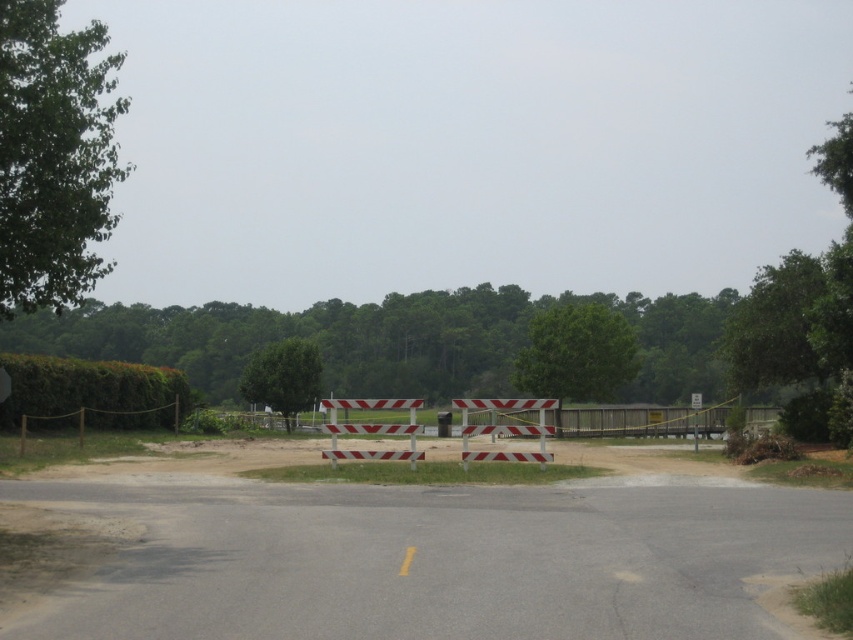
Question: Which object is the farthest from the reflective plastic barricade at center?

Choices:
 (A) white striped plastic barricade at center
 (B) white plastic sign at center

Answer: (B)

Question: Does white striped plastic barricade at center appear over reflective plastic barricade at center?

Choices:
 (A) yes
 (B) no

Answer: (B)

Question: Can you confirm if white striped plastic barricade at center is bigger than reflective plastic barricade at center?

Choices:
 (A) yes
 (B) no

Answer: (B)

Question: Does reflective plastic barricade at center have a lesser width compared to white plastic sign at center?

Choices:
 (A) yes
 (B) no

Answer: (A)

Question: Which is farther from the reflective plastic barricade at center?

Choices:
 (A) white plastic sign at center
 (B) white striped plastic barricade at center

Answer: (A)

Question: Which object is positioned farthest from the white plastic sign at center?

Choices:
 (A) reflective plastic barricade at center
 (B) white striped plastic barricade at center

Answer: (B)